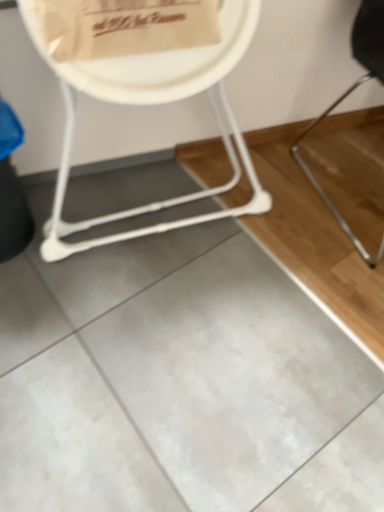
Question: Is white plastic chair at upper left, which is counted as the 1th chair, starting from the left, bigger or smaller than black metal chair at right, the 1th chair positioned from the right?

Choices:
 (A) big
 (B) small

Answer: (A)

Question: In terms of height, does white plastic chair at upper left, the 2th chair in the right-to-left sequence, look taller or shorter compared to black metal chair at right, the 2th chair positioned from the left?

Choices:
 (A) tall
 (B) short

Answer: (A)

Question: Which of these objects is positioned farthest from the black metal chair at right, the 1th chair positioned from the right?

Choices:
 (A) white plastic chair at upper left, which is counted as the 1th chair, starting from the left
 (B) white paper plate at upper center

Answer: (B)

Question: Which object is positioned farthest from the white plastic chair at upper left, the 2th chair in the right-to-left sequence?

Choices:
 (A) white paper plate at upper center
 (B) black metal chair at right, the 2th chair positioned from the left

Answer: (B)